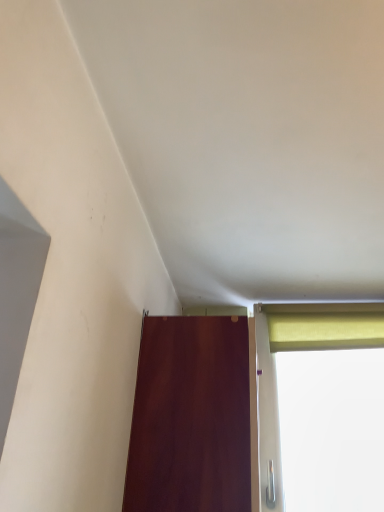
Question: Could you tell me if mahogany wood door at lower center is facing yellow fabric curtain at upper right?

Choices:
 (A) yes
 (B) no

Answer: (B)

Question: Is mahogany wood door at lower center positioned before yellow fabric curtain at upper right?

Choices:
 (A) yes
 (B) no

Answer: (A)

Question: From the image's perspective, is mahogany wood door at lower center located beneath yellow fabric curtain at upper right?

Choices:
 (A) no
 (B) yes

Answer: (B)

Question: Is mahogany wood door at lower center taller than yellow fabric curtain at upper right?

Choices:
 (A) yes
 (B) no

Answer: (A)

Question: Is mahogany wood door at lower center further to the viewer compared to yellow fabric curtain at upper right?

Choices:
 (A) no
 (B) yes

Answer: (A)

Question: From a real-world perspective, is mahogany wood door at lower center positioned under yellow fabric curtain at upper right based on gravity?

Choices:
 (A) no
 (B) yes

Answer: (B)

Question: Is yellow fabric curtain at upper right located outside mahogany wood door at lower center?

Choices:
 (A) yes
 (B) no

Answer: (A)

Question: Does yellow fabric curtain at upper right have a lesser width compared to mahogany wood door at lower center?

Choices:
 (A) no
 (B) yes

Answer: (B)

Question: From the image's perspective, is yellow fabric curtain at upper right located beneath mahogany wood door at lower center?

Choices:
 (A) yes
 (B) no

Answer: (B)

Question: Are yellow fabric curtain at upper right and mahogany wood door at lower center beside each other?

Choices:
 (A) yes
 (B) no

Answer: (B)

Question: Is yellow fabric curtain at upper right at the right side of mahogany wood door at lower center?

Choices:
 (A) yes
 (B) no

Answer: (A)

Question: From a real-world perspective, is yellow fabric curtain at upper right under mahogany wood door at lower center?

Choices:
 (A) no
 (B) yes

Answer: (A)

Question: From a real-world perspective, is yellow fabric curtain at upper right above or below mahogany wood door at lower center?

Choices:
 (A) below
 (B) above

Answer: (B)